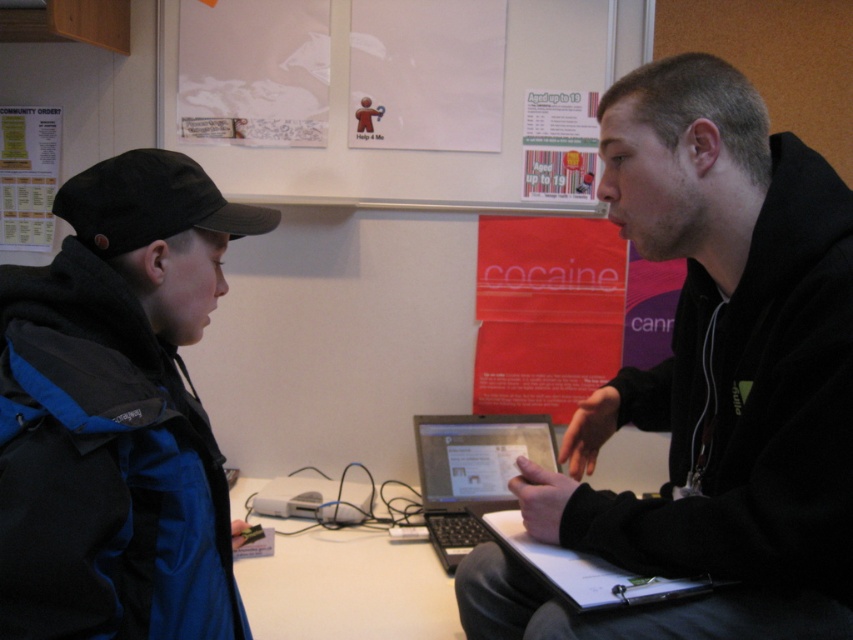
Question: Which object is positioned farthest from the blue fabric jacket at left?

Choices:
 (A) white paper poster at upper left
 (B) matte paper poster at upper center

Answer: (B)

Question: Which point is closer to the camera?

Choices:
 (A) (51, 228)
 (B) (234, 602)

Answer: (B)

Question: Is black matte jacket at center positioned at the back of matte paper poster at upper center?

Choices:
 (A) yes
 (B) no

Answer: (B)

Question: Which object is farther from the camera taking this photo?

Choices:
 (A) red paper poster at center
 (B) white paper poster at upper left
 (C) black matte jacket at center
 (D) white matte paper at upper center

Answer: (A)

Question: Can you confirm if blue fabric jacket at left is wider than white paper poster at upper left?

Choices:
 (A) no
 (B) yes

Answer: (A)

Question: Can you confirm if white paper at upper center is positioned below white paper poster at upper left?

Choices:
 (A) no
 (B) yes

Answer: (B)